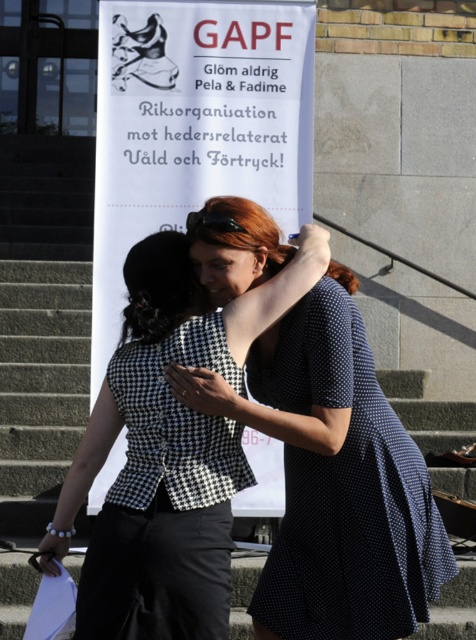
From the picture: Is dark blue dotted dress at center bigger than black houndstooth fabric dress at center?

Indeed, dark blue dotted dress at center has a larger size compared to black houndstooth fabric dress at center.

Between dark blue dotted dress at center and black houndstooth fabric dress at center, which one is positioned higher?

dark blue dotted dress at center is higher up.

Does point (324, 314) come closer to viewer compared to point (235, 436)?

No, (324, 314) is behind (235, 436).

Locate an element on the screen. dark blue dotted dress at center is located at coordinates (345, 490).

Is point (304, 445) positioned in front of point (192, 58)?

Yes, point (304, 445) is in front of point (192, 58).

Locate an element on the screen. This screenshot has width=476, height=640. black checkered blouse at center is located at coordinates (334, 477).

Who is higher up, black checkered blouse at center or dark blue dotted dress at center?

black checkered blouse at center is higher up.

Locate an element on the screen. black checkered blouse at center is located at coordinates (334, 477).

Is point (316, 429) positioned behind point (258, 589)?

No, it is in front of (258, 589).

The width and height of the screenshot is (476, 640). What are the coordinates of `black checkered blouse at center` in the screenshot? It's located at (334, 477).